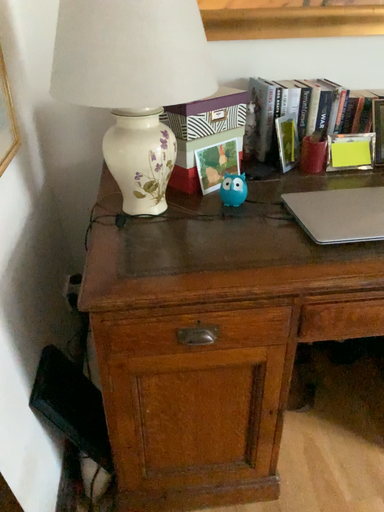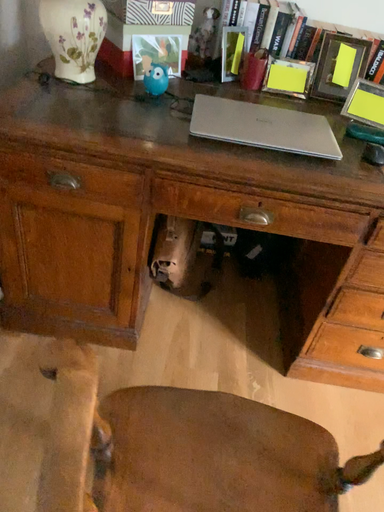
Question: Which way did the camera rotate in the video?

Choices:
 (A) rotated downward
 (B) rotated upward

Answer: (A)